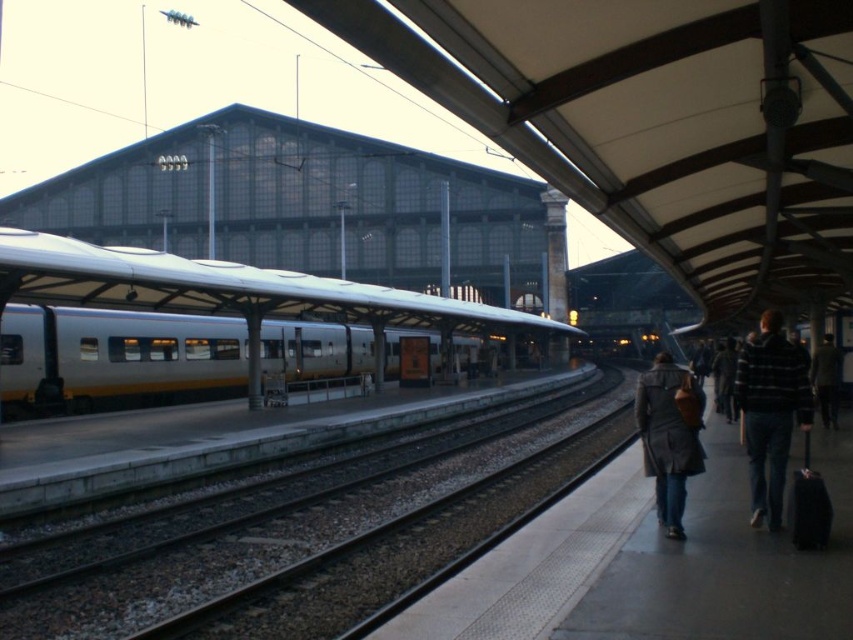
You are a passenger waiting at the train station. You see the yellowmetallictrain track at center and the striped sweater at right. Which object is closer to you?

The yellowmetallictrain track at center is closer to you because it is further to the viewer than the striped sweater at right.

You are standing at the entrance of the train station and want to board the train. Where should you go to find the yellowmetallictrain track at center?

The yellowmetallictrain track at center is located at coordinates point (x=306, y=531).

You are a maintenance worker needing to inspect the gap between the yellowmetallictrain track at center and the silver metallic train at center. Your inspection tool requires a minimum clearance of 10 meters to operate safely. Can you use the tool in this scenario?

The distance between the yellowmetallictrain track at center and the silver metallic train at center is 12.65 meters, which exceeds the required 10 meters clearance. Therefore, the tool can be safely used in this scenario.